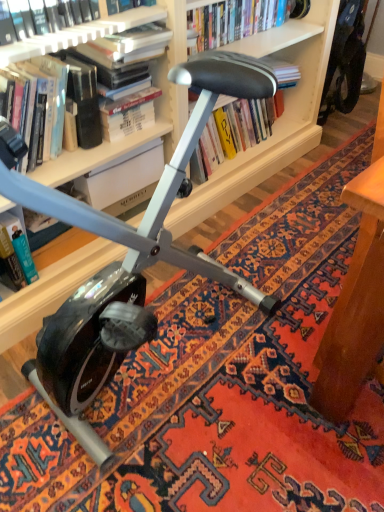
Locate an element on the screen. This screenshot has width=384, height=512. vacant area that lies to the right of matte white bookcase at upper center is located at coordinates (285, 352).